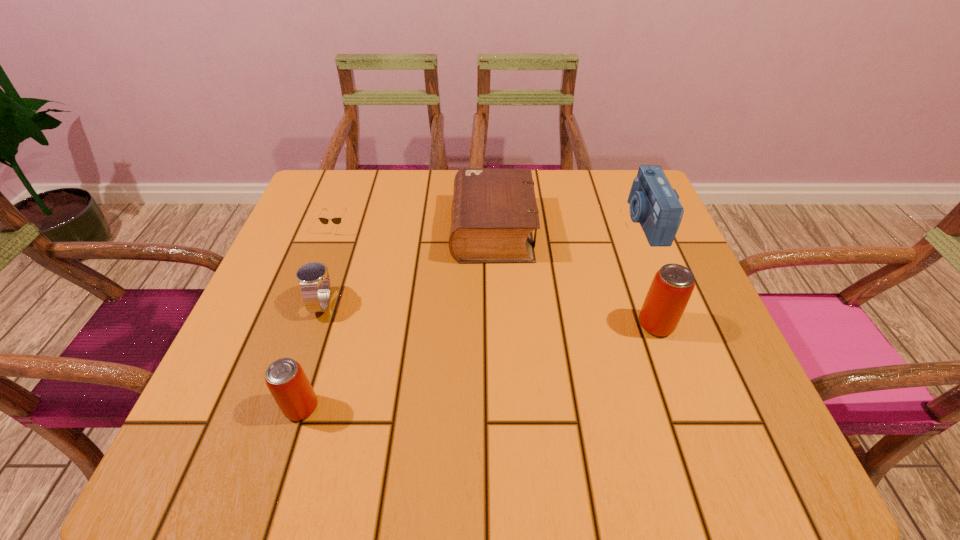
This screenshot has height=540, width=960. Identify the location of free space at the far edge of the desktop. (536, 170).

Identify the location of vacant space at the near edge of the desktop. (533, 393).

In the image, there is a desktop. At what (x,y) coordinates should I click in order to perform the action: click on vacant space at the left edge. Please return your answer as a coordinate pair (x, y). Looking at the image, I should click on (266, 288).

This screenshot has height=540, width=960. In order to click on free region at the right edge of the desktop in this screenshot , I will do `click(695, 309)`.

The height and width of the screenshot is (540, 960). What are the coordinates of `vacant space at the far left corner of the desktop` in the screenshot? It's located at (352, 176).

This screenshot has height=540, width=960. In the image, there is a desktop. Identify the location of free region at the far right corner. (616, 222).

Image resolution: width=960 pixels, height=540 pixels. In order to click on free space between the watch and the sunglasses in this screenshot , I will do `click(330, 266)`.

Find the location of a particular element. The width and height of the screenshot is (960, 540). vacant space that's between the watch and the taller beer can is located at coordinates (490, 314).

Locate an element on the screen. The width and height of the screenshot is (960, 540). vacant region between the camera and the nearer beer can is located at coordinates (473, 315).

Find the location of `vacant space that's between the sunglasses and the watch`. vacant space that's between the sunglasses and the watch is located at coordinates (330, 266).